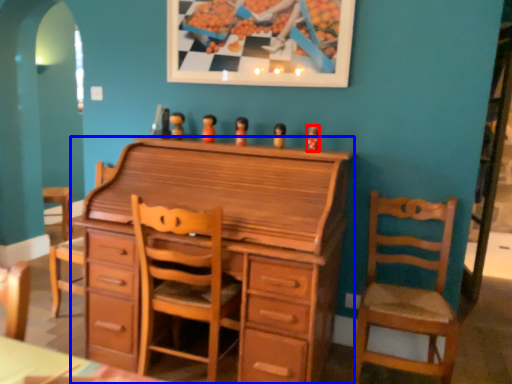
Question: Which object appears closest to the camera in this image, toy (highlighted by a red box) or chest of drawers (highlighted by a blue box)?

Choices:
 (A) toy
 (B) chest of drawers

Answer: (B)